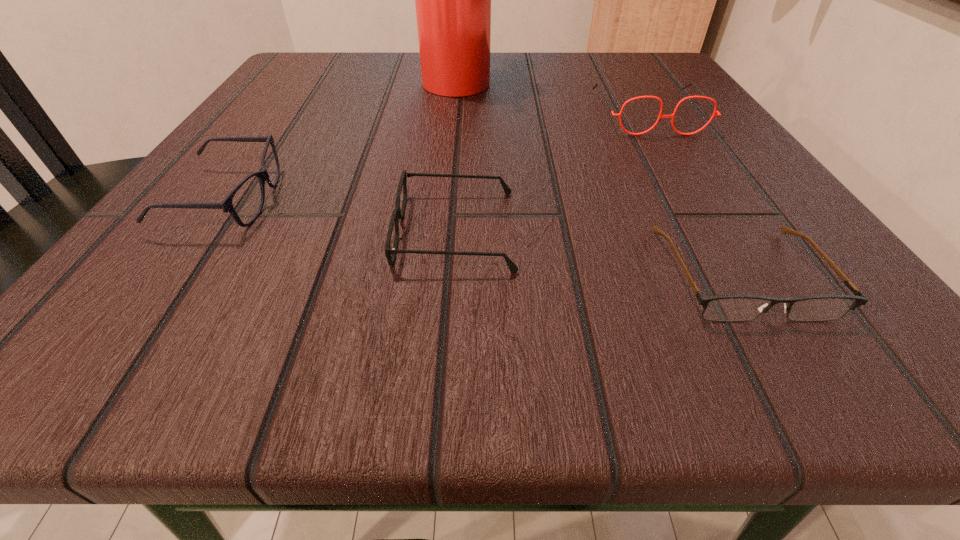
The height and width of the screenshot is (540, 960). I want to click on unoccupied area between the second spectacles from left to right and the farthest spectacles, so click(x=552, y=172).

Identify which object is located as the nearest to the third shortest spectacles. Please provide its 2D coordinates. Your answer should be formatted as a tuple, i.e. [(x, y)], where the tuple contains the x and y coordinates of a point satisfying the conditions above.

[(397, 214)]

Select which object appears as the closest to the third spectacles from right to left. Please provide its 2D coordinates. Your answer should be formatted as a tuple, i.e. [(x, y)], where the tuple contains the x and y coordinates of a point satisfying the conditions above.

[(736, 307)]

Choose which spectacles is the second nearest neighbor to the third shortest spectacles. Please provide its 2D coordinates. Your answer should be formatted as a tuple, i.e. [(x, y)], where the tuple contains the x and y coordinates of a point satisfying the conditions above.

[(736, 307)]

This screenshot has height=540, width=960. Identify the location of spectacles that is the third closest one to the leftmost object. coord(703,96).

Where is `free spot that satisfies the following two spatial constraints: 1. on the front side of the fire extinguisher; 2. on the front-facing side of the second spectacles from left to right`? This screenshot has height=540, width=960. free spot that satisfies the following two spatial constraints: 1. on the front side of the fire extinguisher; 2. on the front-facing side of the second spectacles from left to right is located at coordinates (444, 230).

The width and height of the screenshot is (960, 540). Identify the location of blank space that satisfies the following two spatial constraints: 1. on the front-facing side of the third spectacles from right to left; 2. on the front-facing side of the third shortest object. (458, 199).